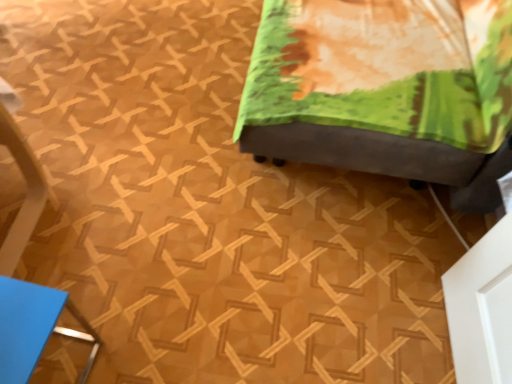
Identify the location of free space to the left of velvet green ottoman at center, the first furniture in the top-to-bottom sequence. Image resolution: width=512 pixels, height=384 pixels. (136, 85).